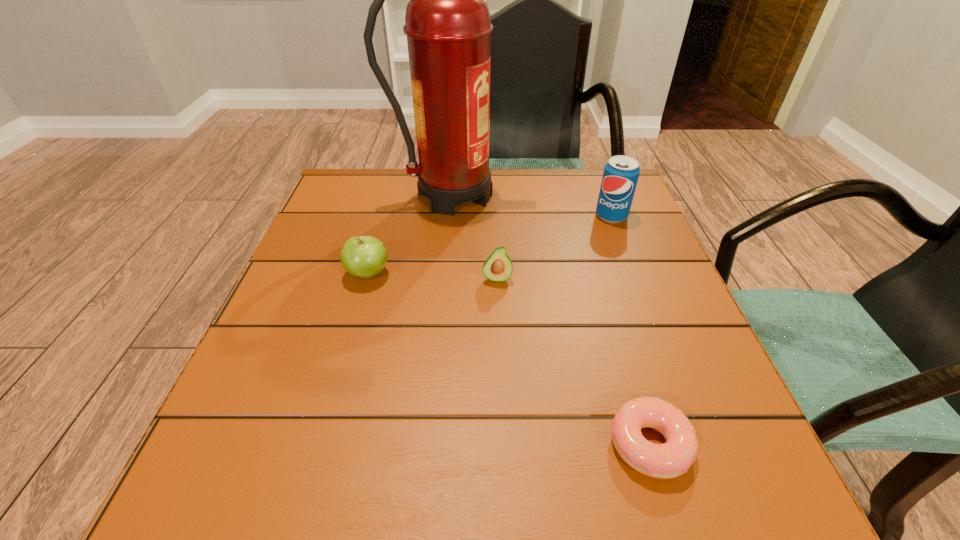
Where is `free space located on the back of the doughnut`? free space located on the back of the doughnut is located at coordinates (610, 309).

You are a GUI agent. You are given a task and a screenshot of the screen. Output one action in this format:
    pyautogui.click(x=<x>, y=<y>)
    Task: Click on the fire extinguisher located at the far edge
    This screenshot has width=960, height=540.
    Given the screenshot: What is the action you would take?
    pyautogui.click(x=448, y=26)

Locate an element on the screen. Image resolution: width=960 pixels, height=540 pixels. soda can at the far edge is located at coordinates (621, 173).

The width and height of the screenshot is (960, 540). What are the coordinates of `object that is at the near edge` in the screenshot? It's located at (671, 459).

You are a GUI agent. You are given a task and a screenshot of the screen. Output one action in this format:
    pyautogui.click(x=<x>, y=<y>)
    Task: Click on the fire extinguisher located at the left edge
    The height and width of the screenshot is (540, 960).
    Given the screenshot: What is the action you would take?
    pyautogui.click(x=448, y=26)

What are the coordinates of `apple at the left edge` in the screenshot? It's located at (364, 257).

This screenshot has height=540, width=960. In order to click on soda can that is at the right edge in this screenshot , I will do `click(621, 173)`.

I want to click on doughnut at the right edge, so click(671, 459).

Identify the location of object present at the far left corner. The height and width of the screenshot is (540, 960). (448, 26).

You are a GUI agent. You are given a task and a screenshot of the screen. Output one action in this format:
    pyautogui.click(x=<x>, y=<y>)
    Task: Click on the object that is at the far right corner
    Image resolution: width=960 pixels, height=540 pixels.
    Given the screenshot: What is the action you would take?
    pyautogui.click(x=621, y=173)